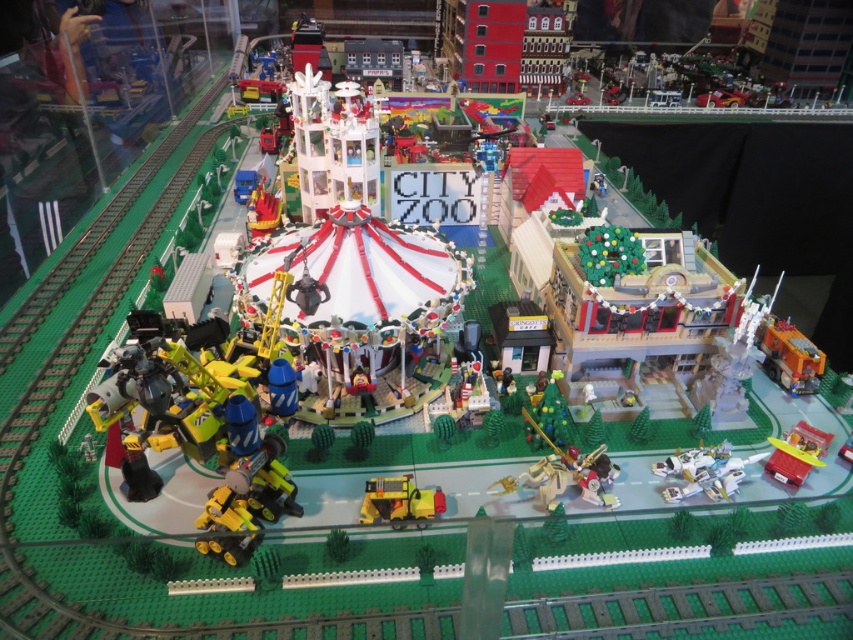
Does yellow matte truck at center come in front of translucent yellow airplane at lower right?

Yes, it is in front of translucent yellow airplane at lower right.

Who is more distant from viewer, (413, 502) or (809, 456)?

Point (809, 456)

Which is behind, point (364, 518) or point (817, 456)?

Point (817, 456)

This screenshot has width=853, height=640. Find the location of `yellow matte truck at center`. yellow matte truck at center is located at coordinates (399, 502).

Between white plastic airplane at lower right and translucent yellow airplane at lower right, which one has more height?

Standing taller between the two is translucent yellow airplane at lower right.

You are a GUI agent. You are given a task and a screenshot of the screen. Output one action in this format:
    pyautogui.click(x=<x>, y=<y>)
    Task: Click on the white plastic airplane at lower right
    Image resolution: width=853 pixels, height=640 pixels.
    Given the screenshot: What is the action you would take?
    pyautogui.click(x=704, y=472)

Can you confirm if gold metallic horse at center is wider than translucent yellow airplane at lower right?

Yes, gold metallic horse at center is wider than translucent yellow airplane at lower right.

Does point (590, 483) lie behind point (822, 451)?

No.

Locate an element on the screen. gold metallic horse at center is located at coordinates (566, 477).